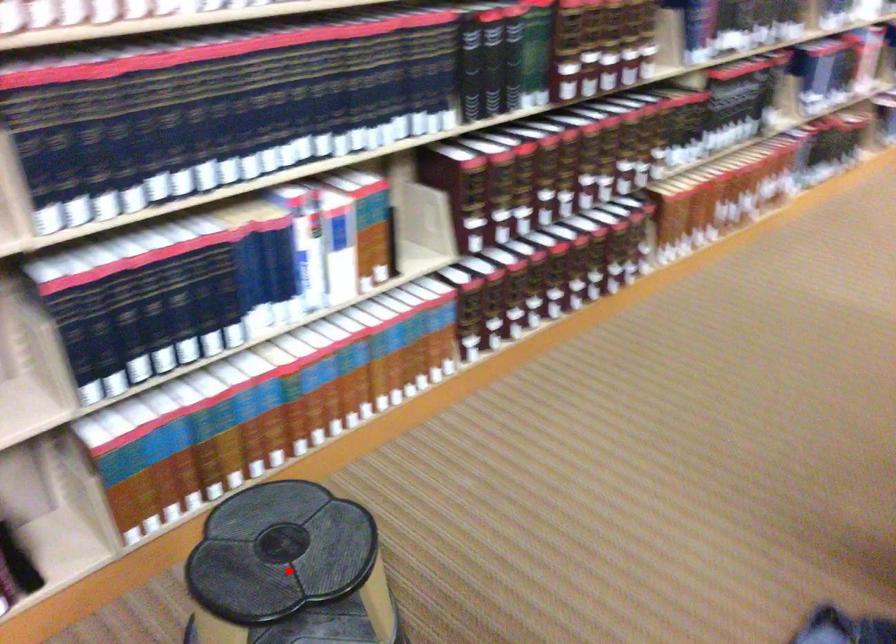
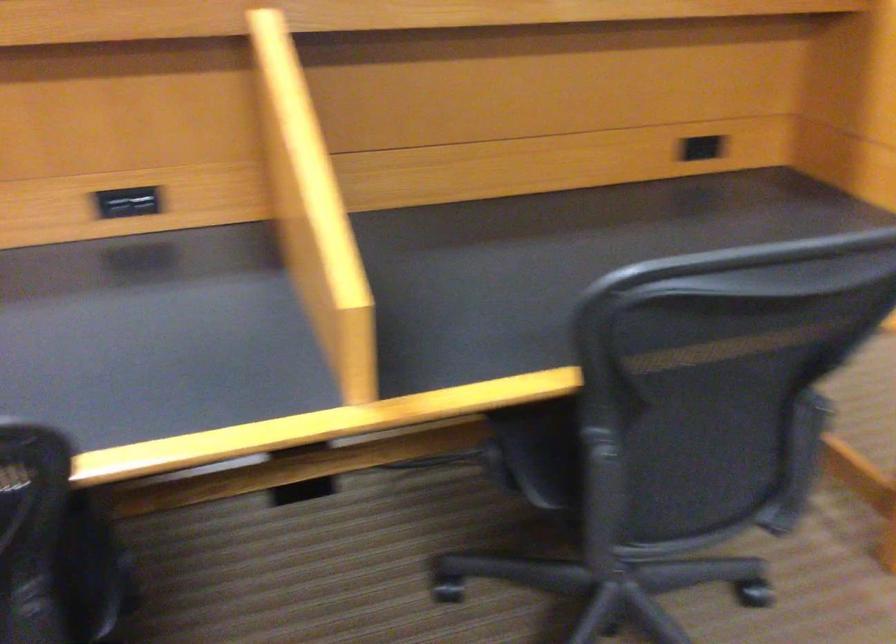
Question: I am providing you with two images of the same scene from different viewpoints. A red point is marked on the first image. Is the red point's position out of view in image 2?

Choices:
 (A) Yes
 (B) No

Answer: (A)